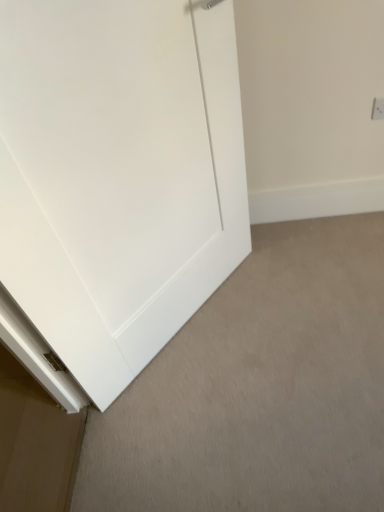
What do you see at coordinates (378, 109) in the screenshot? The width and height of the screenshot is (384, 512). I see `white plastic electric outlet at upper right` at bounding box center [378, 109].

What are the coordinates of `white matte door at center` in the screenshot? It's located at 115,182.

In terms of size, does white plastic electric outlet at upper right appear bigger or smaller than white matte baseboard at lower left?

In the image, white plastic electric outlet at upper right appears to be smaller than white matte baseboard at lower left.

Can you see white plastic electric outlet at upper right touching white matte baseboard at lower left?

They are not placed beside each other.

From a real-world perspective, relative to white matte baseboard at lower left, is white plastic electric outlet at upper right vertically above or below?

From a real-world perspective, white plastic electric outlet at upper right is physically above white matte baseboard at lower left.

Is white plastic electric outlet at upper right inside the boundaries of white matte baseboard at lower left, or outside?

white plastic electric outlet at upper right is spatially situated outside white matte baseboard at lower left.

Is white matte baseboard at lower left shorter than white plastic electric outlet at upper right?

Correct, white matte baseboard at lower left is not as tall as white plastic electric outlet at upper right.

The height and width of the screenshot is (512, 384). What are the coordinates of `plain on the left of white plastic electric outlet at upper right` in the screenshot? It's located at (259, 388).

Considering the positions of objects white matte baseboard at lower left and white plastic electric outlet at upper right in the image provided, who is behind, white matte baseboard at lower left or white plastic electric outlet at upper right?

white plastic electric outlet at upper right is further away from the camera.

From a real-world perspective, is white matte baseboard at lower left physically located above or below white plastic electric outlet at upper right?

Clearly, from a real-world perspective, white matte baseboard at lower left is below white plastic electric outlet at upper right.

Is white matte baseboard at lower left facing away from white matte door at center?

No, white matte door at center is not at the back of white matte baseboard at lower left.

In the scene shown: Is white matte baseboard at lower left not inside white matte door at center?

white matte baseboard at lower left is positioned outside white matte door at center.

From the image's perspective, is white matte baseboard at lower left below white matte door at center?

Correct, white matte baseboard at lower left appears lower than white matte door at center in the image.

Based on the photo, is white matte baseboard at lower left far from white matte door at center?

No, white matte baseboard at lower left is not far away from white matte door at center.

From the image's perspective, between white matte door at center and white plastic electric outlet at upper right, which one is located above?

white plastic electric outlet at upper right, from the image's perspective.

Is white matte door at center not within white plastic electric outlet at upper right?

Yes, white matte door at center is not within white plastic electric outlet at upper right.

How many degrees apart are the facing directions of white matte door at center and white plastic electric outlet at upper right?

49.1 degrees.

From the picture: Which of these two, white matte door at center or white plastic electric outlet at upper right, is thinner?

Thinner between the two is white plastic electric outlet at upper right.

Considering their positions, is white matte door at center located in front of or behind white matte baseboard at lower left?

white matte door at center is positioned closer to the viewer than white matte baseboard at lower left.

Is white matte door at center not within white matte baseboard at lower left?

Yes, white matte door at center is outside of white matte baseboard at lower left.

Does point (11, 234) lie behind point (348, 236)?

That is False.

Can you confirm if white matte door at center is wider than white matte baseboard at lower left?

No.

Is white plastic electric outlet at upper right positioned before white matte door at center?

No, white plastic electric outlet at upper right is further to the viewer.

Can you see white plastic electric outlet at upper right touching white matte door at center?

No, white plastic electric outlet at upper right is not with white matte door at center.

How far apart are white plastic electric outlet at upper right and white matte door at center?

white plastic electric outlet at upper right is 38.31 inches from white matte door at center.

Which is behind, point (375, 114) or point (121, 338)?

Positioned behind is point (375, 114).

Locate an element on the screen. The image size is (384, 512). electric outlet above the white matte baseboard at lower left (from the image's perspective) is located at coordinates (378, 109).

Image resolution: width=384 pixels, height=512 pixels. In order to click on electric outlet behind the white matte baseboard at lower left in this screenshot , I will do `click(378, 109)`.

In the scene shown: Which object lies further to the anchor point white plastic electric outlet at upper right, white matte baseboard at lower left or white matte door at center?

white matte baseboard at lower left.

Considering their positions, is white matte door at center positioned further to white matte baseboard at lower left than white plastic electric outlet at upper right?

white plastic electric outlet at upper right lies further to white matte baseboard at lower left than the other object.

From the image, which object appears to be nearer to white matte door at center, white matte baseboard at lower left or white plastic electric outlet at upper right?

white matte baseboard at lower left lies closer to white matte door at center than the other object.

Which object lies further to the anchor point white plastic electric outlet at upper right, white matte door at center or white matte baseboard at lower left?

Answer: white matte baseboard at lower left is further to white plastic electric outlet at upper right.

When comparing their distances from white matte baseboard at lower left, does white plastic electric outlet at upper right or white matte door at center seem closer?

The object closer to white matte baseboard at lower left is white matte door at center.

Based on the photo, which object lies further to the anchor point white matte door at center, white plastic electric outlet at upper right or white matte baseboard at lower left?

Based on the image, white plastic electric outlet at upper right appears to be further to white matte door at center.

The height and width of the screenshot is (512, 384). In order to click on plain between white matte door at center and white plastic electric outlet at upper right from front to back in this screenshot , I will do `click(259, 388)`.